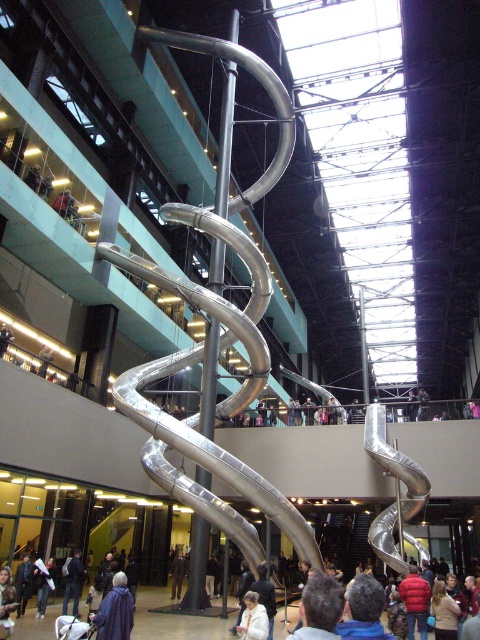
Does purple fabric coat at lower center have a larger size compared to dark blue jacket at lower left?

Yes.

Between purple fabric coat at lower center and dark blue jacket at lower left, which one is positioned lower?

Positioned lower is dark blue jacket at lower left.

Between point (99, 636) and point (74, 596), which one is positioned behind?

The point (74, 596) is behind.

The image size is (480, 640). What are the coordinates of `purple fabric coat at lower center` in the screenshot? It's located at (115, 611).

Between silver/metallic pole at center and dark blue jacket at lower left, which one appears on the left side from the viewer's perspective?

dark blue jacket at lower left is more to the left.

Is silver/metallic pole at center positioned before dark blue jacket at lower left?

No, it is behind dark blue jacket at lower left.

Between point (229, 64) and point (81, 568), which one is positioned behind?

The point (229, 64) is behind.

Find the location of `silver/metallic pole at center`. silver/metallic pole at center is located at coordinates (225, 140).

Is silver/metallic pole at center bigger than purple fabric coat at lower center?

Yes.

The height and width of the screenshot is (640, 480). Identify the location of silver/metallic pole at center. (225, 140).

Locate an element on the screen. The image size is (480, 640). silver/metallic pole at center is located at coordinates (225, 140).